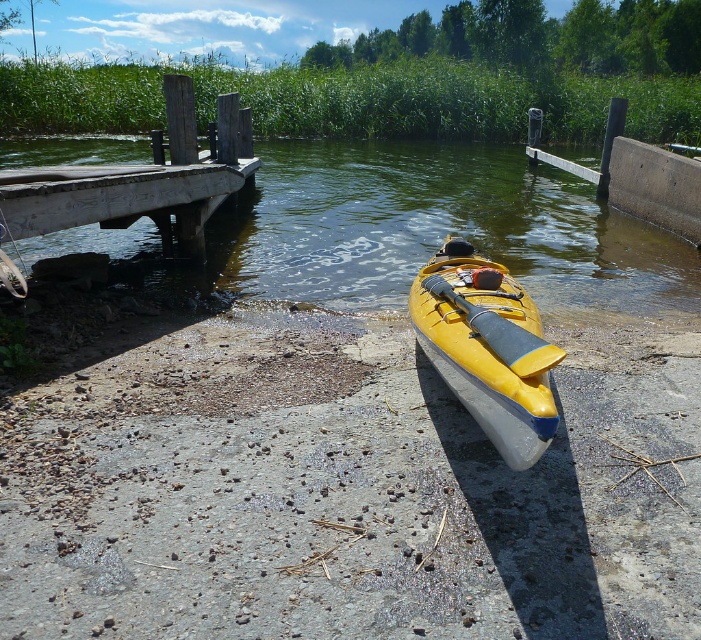
Who is lower down, yellow matte kayak at center or yellow matte paddle at center?

yellow matte kayak at center

Which is in front, point (465, 324) or point (468, 305)?

Point (465, 324)

At what (x,y) coordinates should I click in order to perform the action: click on yellow matte kayak at center. Please return your answer as a coordinate pair (x, y). The height and width of the screenshot is (640, 701). Looking at the image, I should click on (486, 348).

Can you confirm if yellow plastic kayak at lower right is shorter than yellow matte paddle at center?

Incorrect, yellow plastic kayak at lower right's height does not fall short of yellow matte paddle at center's.

Is point (379, 221) behind point (550, 364)?

Yes, point (379, 221) is behind point (550, 364).

At what (x,y) coordinates should I click in order to perform the action: click on yellow plastic kayak at lower right. Please return your answer as a coordinate pair (x, y). This screenshot has width=701, height=640. Looking at the image, I should click on (442, 230).

Is point (611, 282) in front of point (550, 400)?

That is False.

Who is higher up, yellow plastic kayak at lower right or yellow matte kayak at center?

yellow plastic kayak at lower right is above.

The width and height of the screenshot is (701, 640). Identify the location of yellow plastic kayak at lower right. (442, 230).

The image size is (701, 640). I want to click on yellow plastic kayak at lower right, so [x=442, y=230].